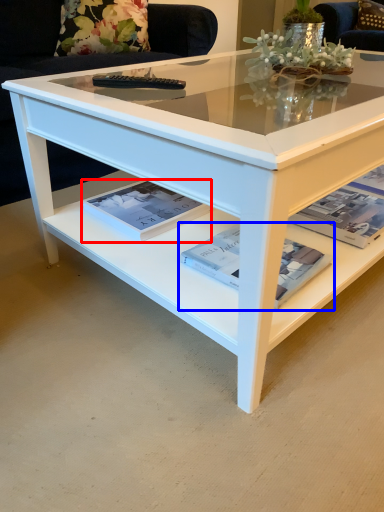
Question: Which point is further to the camera, magazine (highlighted by a red box) or magazine (highlighted by a blue box)?

Choices:
 (A) magazine
 (B) magazine

Answer: (A)